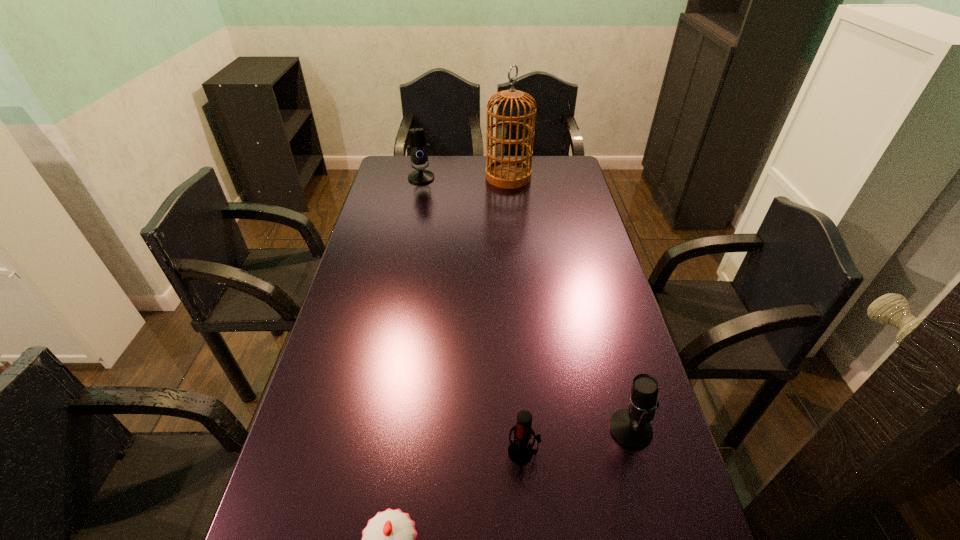
Find the location of a particular element. Image resolution: width=960 pixels, height=540 pixels. the tallest object is located at coordinates (509, 173).

I want to click on the farthest microphone, so click(x=419, y=149).

The height and width of the screenshot is (540, 960). I want to click on the third shortest object, so pos(631,427).

Where is `the rightmost object`? the rightmost object is located at coordinates (631, 427).

I want to click on the shortest microphone, so click(x=520, y=451).

In order to click on the fourth tallest object in this screenshot , I will do `click(520, 451)`.

I want to click on free space located 0.340m on the left of the tallest object, so click(404, 177).

At what (x,y) coordinates should I click in order to perform the action: click on free region located on the stand of the farthest microphone. Please return your answer as a coordinate pair (x, y). Image resolution: width=960 pixels, height=540 pixels. Looking at the image, I should click on (419, 192).

The width and height of the screenshot is (960, 540). In order to click on free spot located 0.060m on the left of the rightmost microphone in this screenshot , I will do `click(584, 429)`.

Locate an element on the screen. The width and height of the screenshot is (960, 540). vacant space situated 0.150m on the back of the second shortest object is located at coordinates pyautogui.click(x=518, y=383).